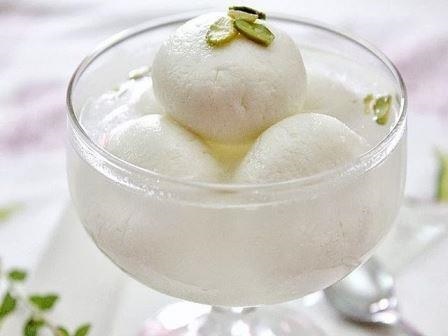
Where is `glass base`? glass base is located at coordinates (188, 324).